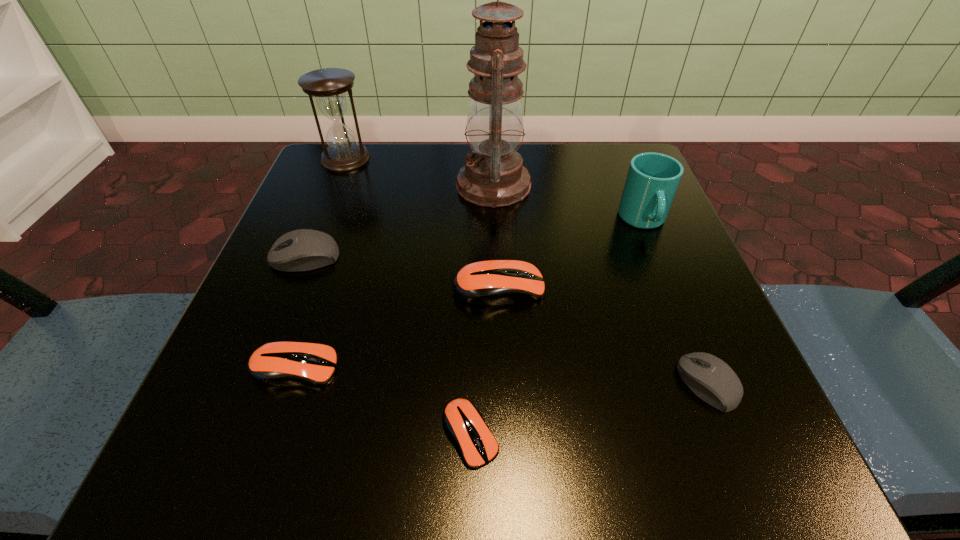
The width and height of the screenshot is (960, 540). I want to click on vacant space that satisfies the following two spatial constraints: 1. on the front side of the rightmost computer mouse; 2. on the left side of the biggest orange computer mouse, so click(x=503, y=384).